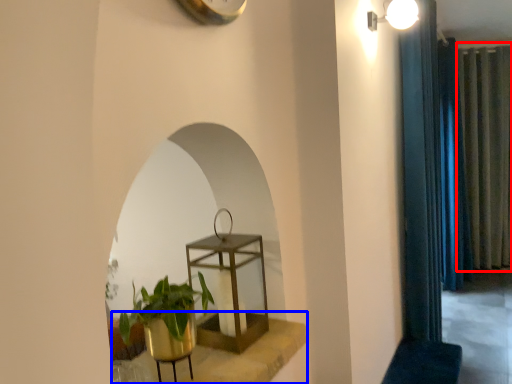
Question: Which object is closer to the camera taking this photo, curtain (highlighted by a red box) or window sill (highlighted by a blue box)?

Choices:
 (A) curtain
 (B) window sill

Answer: (B)